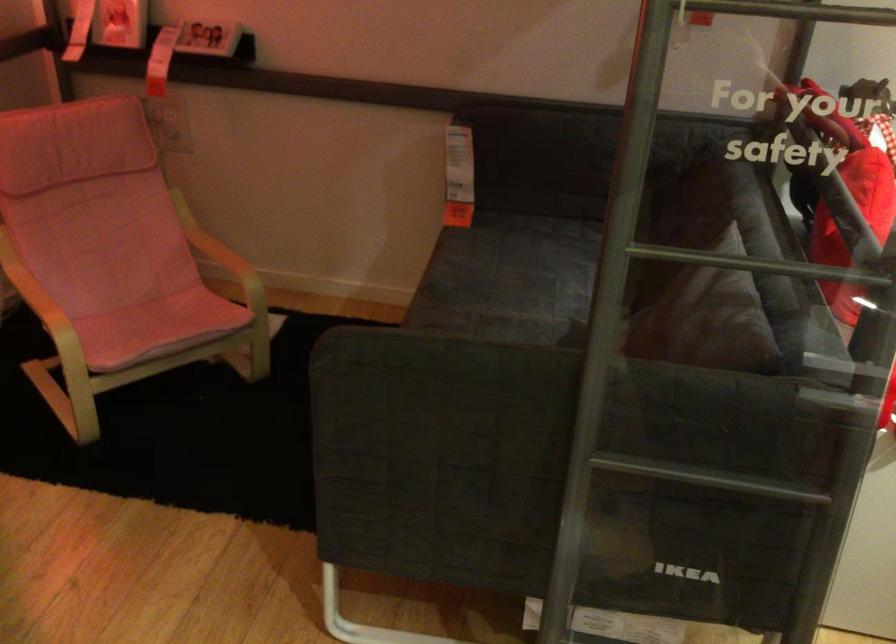
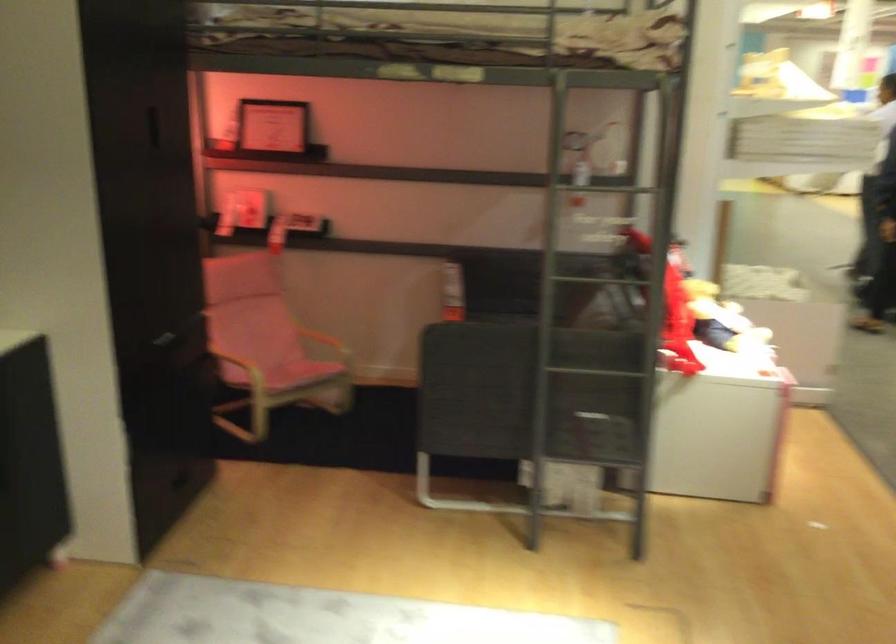
Question: In a continuous first-person perspective shot, in which direction is the camera moving?

Choices:
 (A) Left
 (B) Right
 (C) Forward
 (D) Backward

Answer: (D)